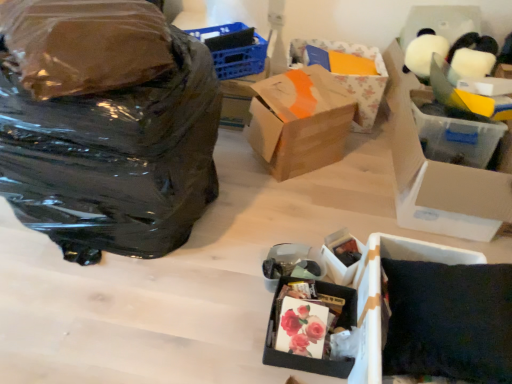
This screenshot has height=384, width=512. Identify the location of dark fabric pillow at lower right. (449, 321).

I want to click on matte black box at lower center, which appears as the first box when ordered from the bottom, so 297,355.

The width and height of the screenshot is (512, 384). What do you see at coordinates (106, 126) in the screenshot?
I see `black plastic bag at left` at bounding box center [106, 126].

This screenshot has width=512, height=384. What do you see at coordinates (300, 121) in the screenshot? I see `brown cardboard box at center, placed as the 4th box when sorted from bottom to top` at bounding box center [300, 121].

Describe the element at coordinates (85, 44) in the screenshot. The image size is (512, 384). I see `transparent plastic bag at left` at that location.

At what (x,y) coordinates should I click in order to perform the action: click on transparent plastic bag at left. Please return your answer as a coordinate pair (x, y). The width and height of the screenshot is (512, 384). Looking at the image, I should click on (85, 44).

Describe the element at coordinates (354, 78) in the screenshot. I see `floral-patterned cardboard box at center, which is counted as the 5th box, starting from the bottom` at that location.

Describe the element at coordinates (341, 256) in the screenshot. This screenshot has width=512, height=384. I see `matte black box at lower center, which is counted as the second box, starting from the bottom` at that location.

Find the location of a particular element. The width and height of the screenshot is (512, 384). dark fabric pillow at lower right is located at coordinates (449, 321).

From a real-world perspective, which object stands above the other?

From a 3D spatial view, blue plastic basket at upper center is above.

Does matte black box at lower center, which is counted as the second box, starting from the bottom, have a larger size compared to blue plastic basket at upper center?

Incorrect, matte black box at lower center, which is counted as the second box, starting from the bottom, is not larger than blue plastic basket at upper center.

Based on the photo, is matte black box at lower center, the 4th box in the top-to-bottom sequence, behind blue plastic basket at upper center?

No.

Is matte black box at lower center, the 4th box in the top-to-bottom sequence, taller or shorter than blue plastic basket at upper center?

In the image, matte black box at lower center, the 4th box in the top-to-bottom sequence, appears to be shorter than blue plastic basket at upper center.

From the matte black box at lower center, which appears as the first box when ordered from the bottom, count 4th box to the right and point to it. Please provide its 2D coordinates.

[(438, 173)]

Could you tell me if matte black box at lower center, which appears as the first box when ordered from the bottom, is facing white cardboard box at upper right, the third box when ordered from top to bottom?

No, matte black box at lower center, which appears as the first box when ordered from the bottom, is not turned towards white cardboard box at upper right, the third box when ordered from top to bottom.

Does matte black box at lower center, which appears as the first box when ordered from the bottom, have a larger size compared to white cardboard box at upper right, which ranks as the third box in bottom-to-top order?

No, matte black box at lower center, which appears as the first box when ordered from the bottom, is not bigger than white cardboard box at upper right, which ranks as the third box in bottom-to-top order.

Is matte black box at lower center, which appears as the first box when ordered from the bottom, next to white cardboard box at upper right, which ranks as the third box in bottom-to-top order, and touching it?

No, matte black box at lower center, which appears as the first box when ordered from the bottom, is not in contact with white cardboard box at upper right, which ranks as the third box in bottom-to-top order.

Can we say matte black box at lower center, which is counted as the second box, starting from the bottom, lies outside matte black box at lower center, the 5th box when ordered from top to bottom?

That's correct, matte black box at lower center, which is counted as the second box, starting from the bottom, is outside of matte black box at lower center, the 5th box when ordered from top to bottom.

Which box is the 1st one when counting from the back of the matte black box at lower center, which appears as the first box when ordered from the bottom? Please provide its 2D coordinates.

[(341, 256)]

Are matte black box at lower center, the 4th box in the top-to-bottom sequence, and matte black box at lower center, which appears as the first box when ordered from the bottom, located far from each other?

No, matte black box at lower center, the 4th box in the top-to-bottom sequence, is not far away from matte black box at lower center, which appears as the first box when ordered from the bottom.

Can you tell me how much matte black box at lower center, the 4th box in the top-to-bottom sequence, and matte black box at lower center, the 5th box when ordered from top to bottom, differ in facing direction?

They differ by 47.3 degrees in their facing directions.

Looking at this image, would you say floral-patterned cardboard box at center, the first box when ordered from top to bottom, is outside brown cardboard box at center, placed as the 4th box when sorted from bottom to top?

Yes.

From the image's perspective, is floral-patterned cardboard box at center, the first box when ordered from top to bottom, located above or below brown cardboard box at center, placed as the 4th box when sorted from bottom to top?

floral-patterned cardboard box at center, the first box when ordered from top to bottom, is situated higher than brown cardboard box at center, placed as the 4th box when sorted from bottom to top, in the image.

Considering the sizes of objects floral-patterned cardboard box at center, which is counted as the 5th box, starting from the bottom, and brown cardboard box at center, placed as the 4th box when sorted from bottom to top, in the image provided, who is smaller, floral-patterned cardboard box at center, which is counted as the 5th box, starting from the bottom, or brown cardboard box at center, placed as the 4th box when sorted from bottom to top,?

floral-patterned cardboard box at center, which is counted as the 5th box, starting from the bottom.

From a real-world perspective, is floral-patterned cardboard box at center, the first box when ordered from top to bottom, located beneath brown cardboard box at center, placed as the 4th box when sorted from bottom to top?

No.

Consider the image. Does transparent plastic bag at left have a lesser width compared to white cardboard box at upper right, which ranks as the third box in bottom-to-top order?

Yes.

Is transparent plastic bag at left at the right side of white cardboard box at upper right, the third box when ordered from top to bottom?

No, transparent plastic bag at left is not to the right of white cardboard box at upper right, the third box when ordered from top to bottom.

Can you confirm if transparent plastic bag at left is shorter than white cardboard box at upper right, which ranks as the third box in bottom-to-top order?

Yes.

How distant is transparent plastic bag at left from white cardboard box at upper right, the third box when ordered from top to bottom?

They are 1.31 meters apart.

From the image's perspective, which object appears higher, matte black box at lower center, the 5th box when ordered from top to bottom, or transparent plastic bag at left?

From the image's view, transparent plastic bag at left is above.

Considering the relative positions of matte black box at lower center, the 5th box when ordered from top to bottom, and transparent plastic bag at left in the image provided, is matte black box at lower center, the 5th box when ordered from top to bottom, behind transparent plastic bag at left?

Yes, matte black box at lower center, the 5th box when ordered from top to bottom, is further from the camera.

Between matte black box at lower center, which appears as the first box when ordered from the bottom, and transparent plastic bag at left, which one appears on the left side from the viewer's perspective?

transparent plastic bag at left.

You are a GUI agent. You are given a task and a screenshot of the screen. Output one action in this format:
    pyautogui.click(x=<x>, y=<y>)
    Task: Click on the plastic bag on the left side of matte black box at lower center, which appears as the first box when ordered from the bottom
    This screenshot has height=384, width=512.
    Given the screenshot: What is the action you would take?
    pyautogui.click(x=85, y=44)

Is matte black box at lower center, which is counted as the second box, starting from the bottom, looking in the opposite direction of brown cardboard box at center, which ranks as the 2th box in top-to-bottom order?

No.

In the scene shown: Does matte black box at lower center, which is counted as the second box, starting from the bottom, have a greater height compared to brown cardboard box at center, placed as the 4th box when sorted from bottom to top?

No, matte black box at lower center, which is counted as the second box, starting from the bottom, is not taller than brown cardboard box at center, placed as the 4th box when sorted from bottom to top.

Between matte black box at lower center, the 4th box in the top-to-bottom sequence, and brown cardboard box at center, placed as the 4th box when sorted from bottom to top, which one has smaller width?

Thinner between the two is matte black box at lower center, the 4th box in the top-to-bottom sequence.

Is matte black box at lower center, which is counted as the second box, starting from the bottom, at the right side of brown cardboard box at center, which ranks as the 2th box in top-to-bottom order?

Yes, matte black box at lower center, which is counted as the second box, starting from the bottom, is to the right of brown cardboard box at center, which ranks as the 2th box in top-to-bottom order.

Locate an element on the screen. basket located above the matte black box at lower center, which is counted as the second box, starting from the bottom (from a real-world perspective) is located at coordinates (241, 60).

What are the coordinates of `the 2nd box in front of the white cardboard box at upper right, the third box when ordered from top to bottom, starting your count from the anchor` in the screenshot? It's located at (297, 355).

When comparing their distances from blue plastic basket at upper center, does brown cardboard box at center, which ranks as the 2th box in top-to-bottom order, or dark fabric pillow at lower right seem closer?

Based on the image, brown cardboard box at center, which ranks as the 2th box in top-to-bottom order, appears to be nearer to blue plastic basket at upper center.

Considering their positions, is white cardboard box at upper right, which ranks as the third box in bottom-to-top order, positioned further to blue plastic basket at upper center than dark fabric pillow at lower right?

The object further to blue plastic basket at upper center is dark fabric pillow at lower right.

Estimate the real-world distances between objects in this image. Which object is further from brown cardboard box at center, placed as the 4th box when sorted from bottom to top, black plastic bag at left or blue plastic basket at upper center?

Among the two, black plastic bag at left is located further to brown cardboard box at center, placed as the 4th box when sorted from bottom to top.

Based on their spatial positions, is floral-patterned cardboard box at center, which is counted as the 5th box, starting from the bottom, or transparent plastic bag at left closer to blue plastic basket at upper center?

The object closer to blue plastic basket at upper center is floral-patterned cardboard box at center, which is counted as the 5th box, starting from the bottom.

Based on their spatial positions, is dark fabric pillow at lower right or blue plastic basket at upper center closer to transparent plastic bag at left?

blue plastic basket at upper center.

Looking at this image, estimate the real-world distances between objects in this image. Which object is further from matte black box at lower center, which is counted as the second box, starting from the bottom, black plastic bag at left or transparent plastic bag at left?

transparent plastic bag at left lies further to matte black box at lower center, which is counted as the second box, starting from the bottom, than the other object.

Based on their spatial positions, is transparent plastic bag at left or floral-patterned cardboard box at center, the first box when ordered from top to bottom, closer to black plastic bag at left?

The object closer to black plastic bag at left is transparent plastic bag at left.

When comparing their distances from white cardboard box at upper right, which ranks as the third box in bottom-to-top order, does brown cardboard box at center, which ranks as the 2th box in top-to-bottom order, or matte black box at lower center, which is counted as the second box, starting from the bottom, seem further?

Based on the image, matte black box at lower center, which is counted as the second box, starting from the bottom, appears to be further to white cardboard box at upper right, which ranks as the third box in bottom-to-top order.

Where is `plastic bag between dark fabric pillow at lower right and floral-patterned cardboard box at center, the first box when ordered from top to bottom, from front to back`? The image size is (512, 384). plastic bag between dark fabric pillow at lower right and floral-patterned cardboard box at center, the first box when ordered from top to bottom, from front to back is located at coordinates (85, 44).

Find the location of a particular element. Image resolution: width=512 pixels, height=384 pixels. bag between blue plastic basket at upper center and matte black box at lower center, which appears as the first box when ordered from the bottom, vertically is located at coordinates (106, 126).

At what (x,y) coordinates should I click in order to perform the action: click on plastic bag between black plastic bag at left and brown cardboard box at center, placed as the 4th box when sorted from bottom to top, from left to right. Please return your answer as a coordinate pair (x, y). The width and height of the screenshot is (512, 384). Looking at the image, I should click on (85, 44).

At what (x,y) coordinates should I click in order to perform the action: click on basket located between black plastic bag at left and matte black box at lower center, the 4th box in the top-to-bottom sequence, in the left-right direction. Please return your answer as a coordinate pair (x, y). Looking at the image, I should click on (241, 60).